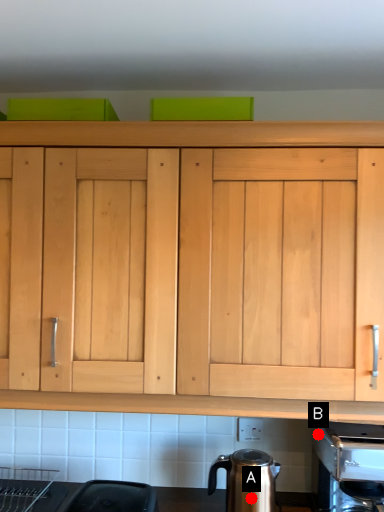
Question: Two points are circled on the image, labeled by A and B beside each circle. Which point is closer to the camera taking this photo?

Choices:
 (A) A is closer
 (B) B is closer

Answer: (A)